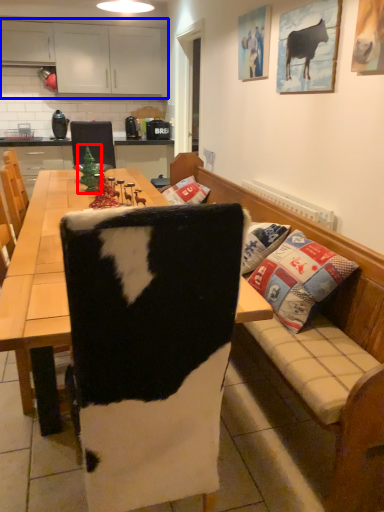
Question: Which object appears farthest to the camera in this image, christmas tree (highlighted by a red box) or cabinetry (highlighted by a blue box)?

Choices:
 (A) christmas tree
 (B) cabinetry

Answer: (B)